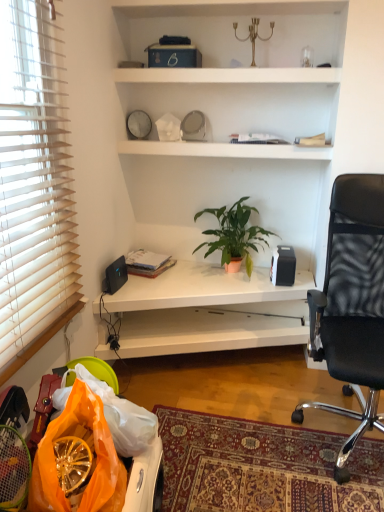
In order to click on vacant space that's between black plastic speaker at lower left, the 1th loudspeaker when ordered from left to right, and matte black book at left in this screenshot , I will do `click(126, 283)`.